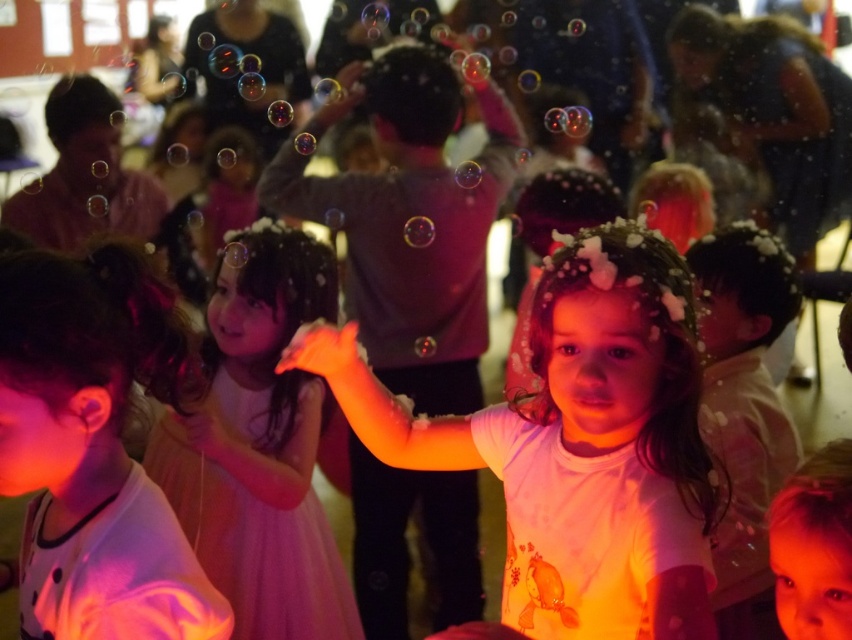
Question: Does pink satin dress at center have a smaller size compared to smooth skin face at center?

Choices:
 (A) no
 (B) yes

Answer: (A)

Question: Is matte white dress at center below transparent soap bubble at center?

Choices:
 (A) no
 (B) yes

Answer: (B)

Question: Which point is closer to the camera?

Choices:
 (A) pink satin dress at center
 (B) transparent soap bubble at center
 (C) smooth cream shirt at center

Answer: (A)

Question: Among these points, which one is nearest to the camera?

Choices:
 (A) (278, 592)
 (B) (769, 483)
 (C) (43, 589)

Answer: (C)

Question: Which object is the closest to the white matte shirt at center?

Choices:
 (A) pink satin dress at center
 (B) smooth skin face at center
 (C) smooth cream shirt at center
 (D) matte white shirt at center

Answer: (B)

Question: Is white matte shirt at center smaller than smooth cream shirt at center?

Choices:
 (A) yes
 (B) no

Answer: (B)